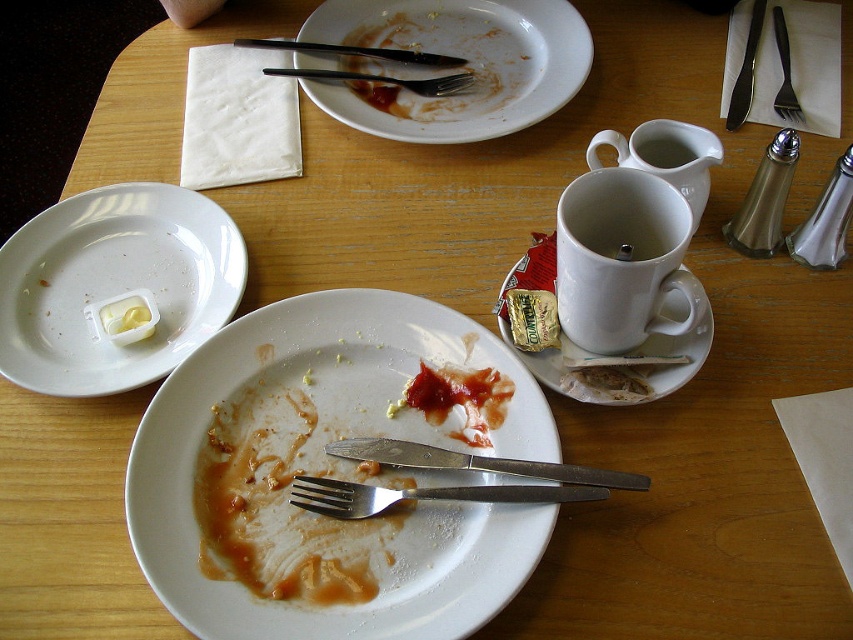
How much distance is there between white ceramic mug at center and ketchup paste at center?

white ceramic mug at center is 3.05 inches from ketchup paste at center.

Who is more distant from viewer, (647, 380) or (444, 390)?

Point (444, 390)

I want to click on white ceramic mug at center, so click(602, 355).

Does point (103, 296) come farther from viewer compared to point (460, 58)?

No, it is not.

This screenshot has width=853, height=640. I want to click on white glossy plate at left, so click(x=115, y=285).

I want to click on white glossy plate at left, so click(115, 285).

Is polished metal knife at lower center smaller than brushed metal fork at upper center?

Correct, polished metal knife at lower center occupies less space than brushed metal fork at upper center.

Can you confirm if polished metal knife at lower center is thinner than brushed metal fork at upper center?

No, polished metal knife at lower center is not thinner than brushed metal fork at upper center.

You are a GUI agent. You are given a task and a screenshot of the screen. Output one action in this format:
    pyautogui.click(x=<x>, y=<y>)
    Task: Click on the polished metal knife at lower center
    The image size is (853, 640).
    Given the screenshot: What is the action you would take?
    pyautogui.click(x=479, y=461)

At what (x,y) coordinates should I click in order to perform the action: click on polished metal knife at lower center. Please return your answer as a coordinate pair (x, y). This screenshot has height=640, width=853. Looking at the image, I should click on (479, 461).